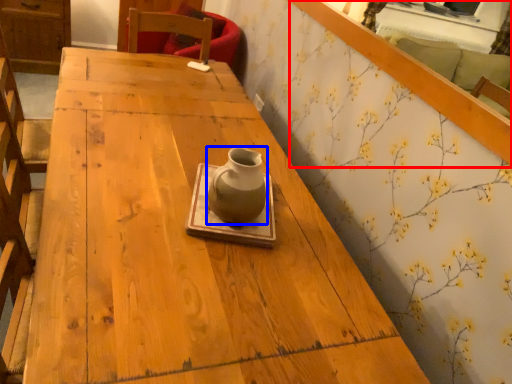
Question: Which object appears farthest to the camera in this image, mirror (highlighted by a red box) or vase (highlighted by a blue box)?

Choices:
 (A) mirror
 (B) vase

Answer: (B)